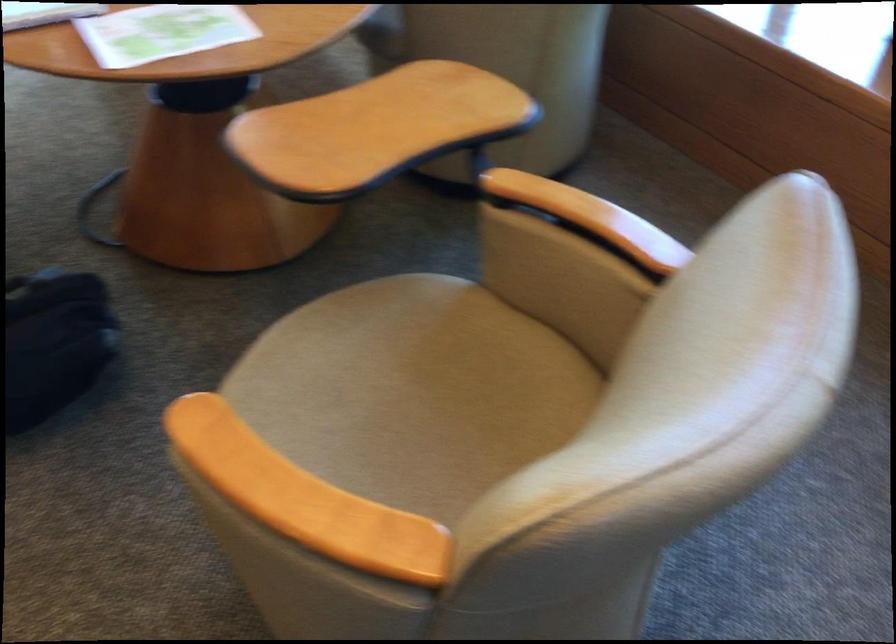
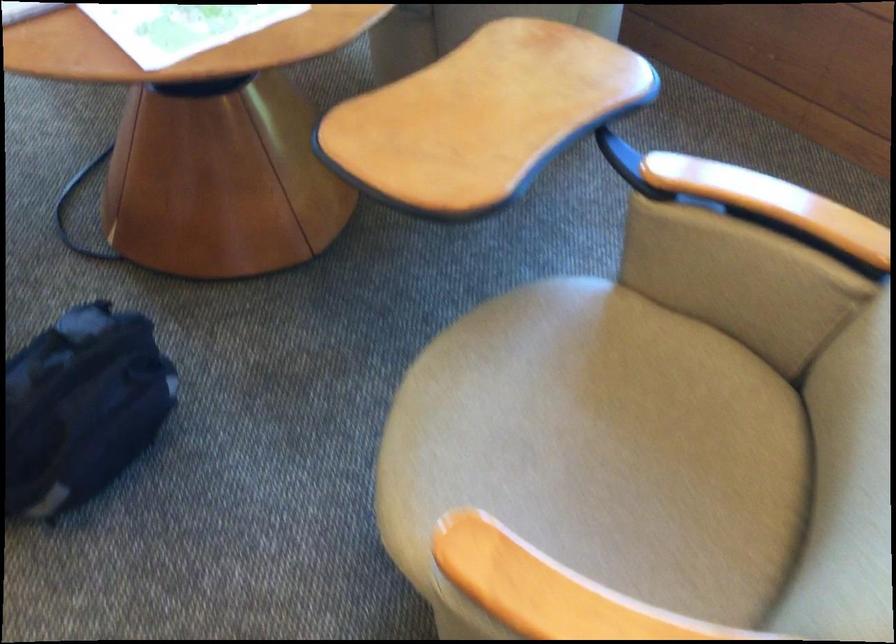
Locate, in the second image, the point that corresponds to point 582,212 in the first image.

(771, 202)